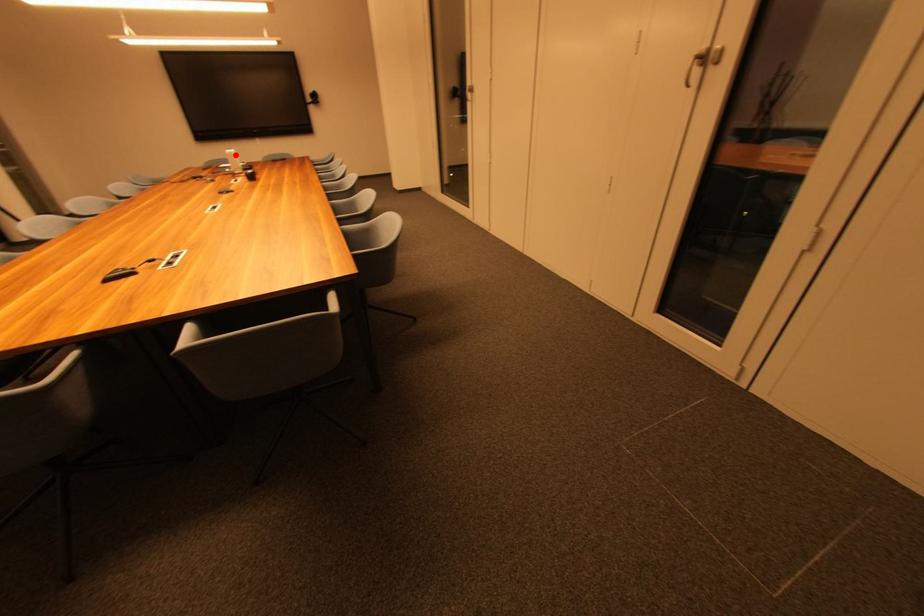
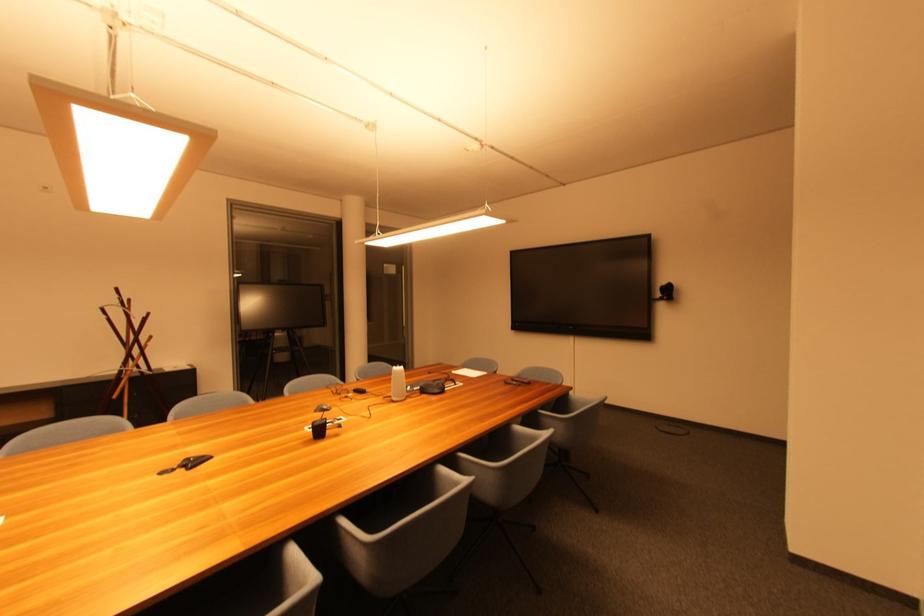
Question: A red point is marked in image1. In image2, is the corresponding 3D point closer to the camera or farther? Reply with the corresponding letter.

Choices:
 (A) The corresponding 3D point is closer.
 (B) The corresponding 3D point is farther.

Answer: (A)